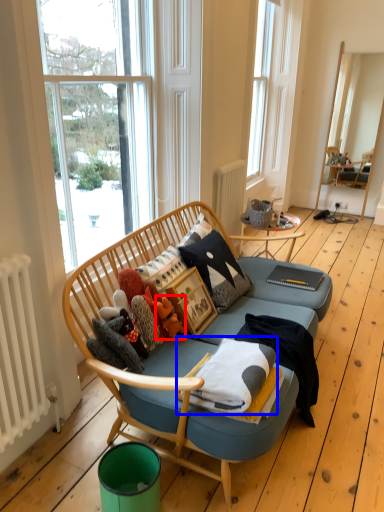
Question: Which object appears farthest to the camera in this image, toy (highlighted by a red box) or blanket (highlighted by a blue box)?

Choices:
 (A) toy
 (B) blanket

Answer: (A)